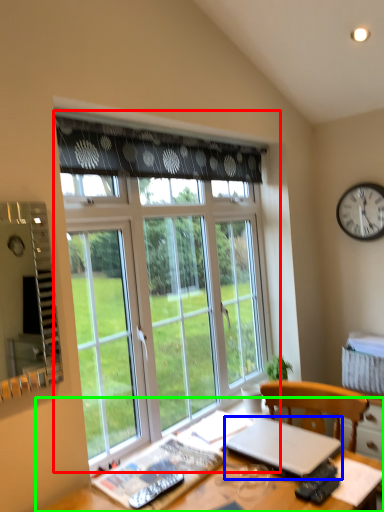
Question: Based on their relative distances, which object is farther from window (highlighted by a red box)? Choose from laptop (highlighted by a blue box) and desk (highlighted by a green box).

Choices:
 (A) laptop
 (B) desk

Answer: (B)